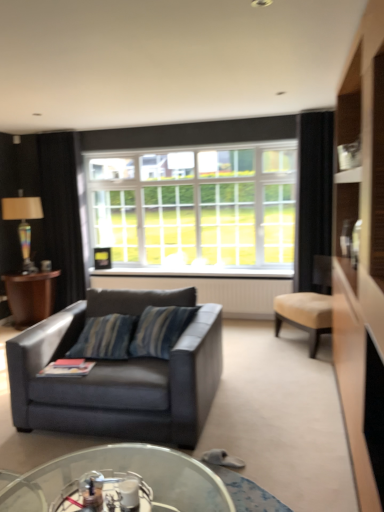
Question: From their relative heights in the image, would you say black fabric curtain at right, placed as the 1th curtain when sorted from right to left, is taller or shorter than transparent glass coffee table at lower center?

Choices:
 (A) short
 (B) tall

Answer: (B)

Question: Do you think black fabric curtain at right, the 2th curtain viewed from the back, is within transparent glass coffee table at lower center, or outside of it?

Choices:
 (A) outside
 (B) inside

Answer: (A)

Question: Which object is the closest to the transparent glass coffee table at lower center?

Choices:
 (A) black fabric curtain at left, placed as the 1th curtain when sorted from back to front
 (B) beige fabric ottoman at right
 (C) black fabric curtain at right, the 1th curtain viewed from the front
 (D) wooden side table at left
 (E) multicolored glass lamp at left

Answer: (B)

Question: Which object is the farthest from the black fabric curtain at right, the 2th curtain viewed from the back?

Choices:
 (A) black fabric curtain at left, placed as the 1th curtain when sorted from back to front
 (B) multicolored glass lamp at left
 (C) leather couch at lower left
 (D) wooden side table at left
 (E) transparent glass coffee table at lower center

Answer: (B)